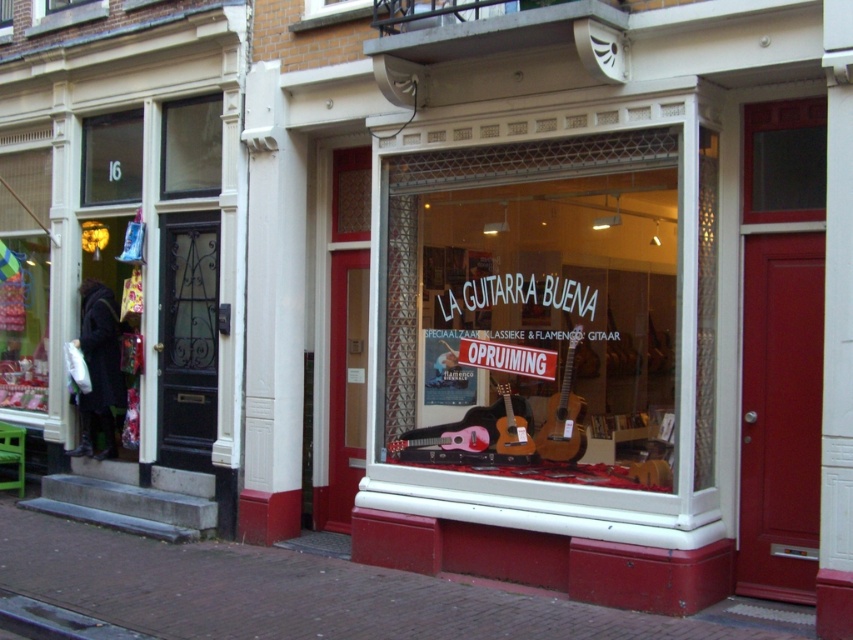
Does point (419, 310) come closer to viewer compared to point (187, 180)?

Yes, it is in front of point (187, 180).

The width and height of the screenshot is (853, 640). Describe the element at coordinates (543, 310) in the screenshot. I see `clear glass guitars at center` at that location.

Where is `clear glass guitars at center`? The height and width of the screenshot is (640, 853). clear glass guitars at center is located at coordinates (543, 310).